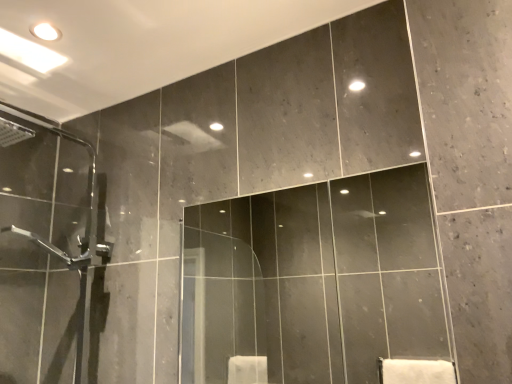
Question: From the image's perspective, is matte glass mirror at center above clear glass shower door at left?

Choices:
 (A) yes
 (B) no

Answer: (B)

Question: Is matte glass mirror at center closer to the viewer compared to clear glass shower door at left?

Choices:
 (A) yes
 (B) no

Answer: (A)

Question: Is matte glass mirror at center thinner than clear glass shower door at left?

Choices:
 (A) yes
 (B) no

Answer: (A)

Question: Does matte glass mirror at center have a larger size compared to clear glass shower door at left?

Choices:
 (A) yes
 (B) no

Answer: (B)

Question: From the image's perspective, is matte glass mirror at center under clear glass shower door at left?

Choices:
 (A) no
 (B) yes

Answer: (B)

Question: Is matte glass mirror at center outside of clear glass shower door at left?

Choices:
 (A) no
 (B) yes

Answer: (B)

Question: From a real-world perspective, is clear glass shower door at left under matte glass mirror at center?

Choices:
 (A) no
 (B) yes

Answer: (A)

Question: Would you say clear glass shower door at left is outside matte glass mirror at center?

Choices:
 (A) yes
 (B) no

Answer: (A)

Question: Is clear glass shower door at left surrounding matte glass mirror at center?

Choices:
 (A) yes
 (B) no

Answer: (B)

Question: Is clear glass shower door at left positioned with its back to matte glass mirror at center?

Choices:
 (A) no
 (B) yes

Answer: (A)

Question: Could you tell me if clear glass shower door at left is facing matte glass mirror at center?

Choices:
 (A) yes
 (B) no

Answer: (B)

Question: From the image's perspective, is clear glass shower door at left over matte glass mirror at center?

Choices:
 (A) yes
 (B) no

Answer: (A)

Question: In terms of size, does clear glass shower door at left appear bigger or smaller than matte glass mirror at center?

Choices:
 (A) big
 (B) small

Answer: (A)